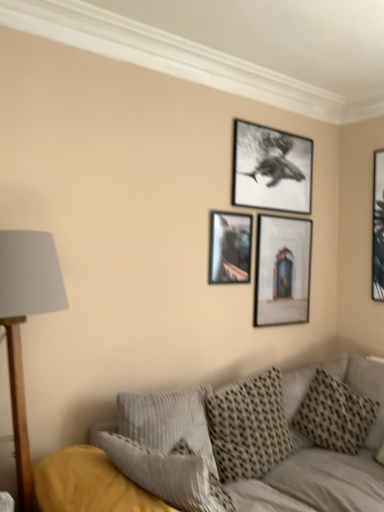
This screenshot has width=384, height=512. Find the location of `textured gray pillow at lower center, arranged as the 1th pillow when viewed from the left`. textured gray pillow at lower center, arranged as the 1th pillow when viewed from the left is located at coordinates (168, 420).

Describe the element at coordinates (271, 169) in the screenshot. I see `black matte picture frame at upper center, positioned as the second picture frame in left-to-right order` at that location.

This screenshot has width=384, height=512. What do you see at coordinates (282, 270) in the screenshot?
I see `matte wooden picture frame at center, which ranks as the 2th picture frame in right-to-left order` at bounding box center [282, 270].

Image resolution: width=384 pixels, height=512 pixels. Describe the element at coordinates (334, 415) in the screenshot. I see `patterned fabric pillow at right, the 1th pillow positioned from the right` at that location.

Measure the distance between patterned fabric pillow at center, arranged as the second pillow when viewed from the left, and camera.

7.09 feet.

Measure the distance between point (x=220, y=458) and camera.

The distance of point (x=220, y=458) from camera is 2.20 meters.

The height and width of the screenshot is (512, 384). What do you see at coordinates (378, 227) in the screenshot? I see `matte black picture frame at right, arranged as the 4th picture frame when viewed from the left` at bounding box center [378, 227].

The width and height of the screenshot is (384, 512). What do you see at coordinates (234, 447) in the screenshot? I see `textured gray couch at lower right` at bounding box center [234, 447].

The height and width of the screenshot is (512, 384). I want to click on textured gray pillow at lower center, which is counted as the third pillow, starting from the right, so click(x=168, y=420).

Relative to wooden base with gray fabric lampshade at left, is metallic silver picture frame at center, placed as the first picture frame when sorted from left to right, in front or behind?

Visually, metallic silver picture frame at center, placed as the first picture frame when sorted from left to right, is located behind wooden base with gray fabric lampshade at left.

Measure the distance from metallic silver picture frame at center, which ranks as the 4th picture frame in right-to-left order, to wooden base with gray fabric lampshade at left.

They are 1.20 meters apart.

Does metallic silver picture frame at center, placed as the first picture frame when sorted from left to right, have a larger size compared to wooden base with gray fabric lampshade at left?

No.

Between metallic silver picture frame at center, placed as the first picture frame when sorted from left to right, and wooden base with gray fabric lampshade at left, which one has more height?

With more height is wooden base with gray fabric lampshade at left.

Considering the sizes of patterned fabric pillow at center, acting as the second pillow starting from the right, and patterned fabric pillow at right, the third pillow when ordered from left to right, in the image, is patterned fabric pillow at center, acting as the second pillow starting from the right, wider or thinner than patterned fabric pillow at right, the third pillow when ordered from left to right,?

Considering their sizes, patterned fabric pillow at center, acting as the second pillow starting from the right, looks slimmer than patterned fabric pillow at right, the third pillow when ordered from left to right.

Identify the location of pillow below the patterned fabric pillow at right, the third pillow when ordered from left to right (from the image's perspective). (249, 426).

Considering the positions of objects patterned fabric pillow at center, acting as the second pillow starting from the right, and patterned fabric pillow at right, the third pillow when ordered from left to right, in the image provided, who is more to the right, patterned fabric pillow at center, acting as the second pillow starting from the right, or patterned fabric pillow at right, the third pillow when ordered from left to right,?

patterned fabric pillow at right, the third pillow when ordered from left to right.

Would you say patterned fabric pillow at center, acting as the second pillow starting from the right, is inside or outside patterned fabric pillow at right, the third pillow when ordered from left to right?

patterned fabric pillow at center, acting as the second pillow starting from the right, lies outside patterned fabric pillow at right, the third pillow when ordered from left to right.

Is black matte picture frame at upper center, positioned as the second picture frame in left-to-right order, located outside textured gray couch at lower right?

Yes, black matte picture frame at upper center, positioned as the second picture frame in left-to-right order, is located beyond the bounds of textured gray couch at lower right.

From the image's perspective, does black matte picture frame at upper center, the 3th picture frame in the right-to-left sequence, appear lower than textured gray couch at lower right?

No, from the image's perspective, black matte picture frame at upper center, the 3th picture frame in the right-to-left sequence, is not below textured gray couch at lower right.

Measure the distance from black matte picture frame at upper center, the 3th picture frame in the right-to-left sequence, to textured gray couch at lower right.

black matte picture frame at upper center, the 3th picture frame in the right-to-left sequence, is 4.37 feet away from textured gray couch at lower right.

How many degrees apart are the facing directions of black matte picture frame at upper center, the 3th picture frame in the right-to-left sequence, and textured gray couch at lower right?

92 degrees separate the facing orientations of black matte picture frame at upper center, the 3th picture frame in the right-to-left sequence, and textured gray couch at lower right.

Is black matte picture frame at upper center, the 3th picture frame in the right-to-left sequence, facing away from patterned fabric pillow at right, the third pillow when ordered from left to right?

No.

Based on the photo, is black matte picture frame at upper center, positioned as the second picture frame in left-to-right order, inside the boundaries of patterned fabric pillow at right, the third pillow when ordered from left to right, or outside?

black matte picture frame at upper center, positioned as the second picture frame in left-to-right order, is located beyond the bounds of patterned fabric pillow at right, the third pillow when ordered from left to right.

Between black matte picture frame at upper center, the 3th picture frame in the right-to-left sequence, and patterned fabric pillow at right, the 1th pillow positioned from the right, which one has smaller width?

black matte picture frame at upper center, the 3th picture frame in the right-to-left sequence.

Between point (272, 131) and point (305, 401), which one is positioned in front?

The point (305, 401) is in front.

From the image's perspective, is matte wooden picture frame at center, which ranks as the 2th picture frame in right-to-left order, above metallic silver picture frame at center, placed as the first picture frame when sorted from left to right?

No, from the image's perspective, matte wooden picture frame at center, which ranks as the 2th picture frame in right-to-left order, is not on top of metallic silver picture frame at center, placed as the first picture frame when sorted from left to right.

Considering the sizes of matte wooden picture frame at center, which ranks as the 2th picture frame in right-to-left order, and metallic silver picture frame at center, which ranks as the 4th picture frame in right-to-left order, in the image, is matte wooden picture frame at center, which ranks as the 2th picture frame in right-to-left order, bigger or smaller than metallic silver picture frame at center, which ranks as the 4th picture frame in right-to-left order,?

In the image, matte wooden picture frame at center, which ranks as the 2th picture frame in right-to-left order, appears to be larger than metallic silver picture frame at center, which ranks as the 4th picture frame in right-to-left order.

Could you tell me if matte wooden picture frame at center, the third picture frame when ordered from left to right, is facing metallic silver picture frame at center, placed as the first picture frame when sorted from left to right?

No, matte wooden picture frame at center, the third picture frame when ordered from left to right, is not oriented towards metallic silver picture frame at center, placed as the first picture frame when sorted from left to right.

From the picture: Which object is further away from the camera taking this photo, matte wooden picture frame at center, the third picture frame when ordered from left to right, or metallic silver picture frame at center, which ranks as the 4th picture frame in right-to-left order?

matte wooden picture frame at center, the third picture frame when ordered from left to right, is further from the camera.

Considering the relative sizes of matte wooden picture frame at center, the third picture frame when ordered from left to right, and textured gray pillow at lower center, arranged as the 1th pillow when viewed from the left, in the image provided, is matte wooden picture frame at center, the third picture frame when ordered from left to right, bigger than textured gray pillow at lower center, arranged as the 1th pillow when viewed from the left,?

Incorrect, matte wooden picture frame at center, the third picture frame when ordered from left to right, is not larger than textured gray pillow at lower center, arranged as the 1th pillow when viewed from the left.

How far apart are matte wooden picture frame at center, the third picture frame when ordered from left to right, and textured gray pillow at lower center, arranged as the 1th pillow when viewed from the left?

matte wooden picture frame at center, the third picture frame when ordered from left to right, and textured gray pillow at lower center, arranged as the 1th pillow when viewed from the left, are 37.19 inches apart from each other.

Which is less distant, (276, 233) or (186, 438)?

Point (276, 233) appears to be farther away from the viewer than point (186, 438).

There is a matte wooden picture frame at center, the third picture frame when ordered from left to right. Find the location of `the 1st pillow below it (from a real-world perspective)`. the 1st pillow below it (from a real-world perspective) is located at coordinates (168, 420).

Does patterned fabric pillow at center, arranged as the second pillow when viewed from the left, appear on the right side of textured gray couch at lower right?

In fact, patterned fabric pillow at center, arranged as the second pillow when viewed from the left, is to the left of textured gray couch at lower right.

Which is less distant, (265, 471) or (160, 453)?

Point (265, 471).

Who is smaller, patterned fabric pillow at center, arranged as the second pillow when viewed from the left, or textured gray couch at lower right?

patterned fabric pillow at center, arranged as the second pillow when viewed from the left.

Locate an element on the screen. The width and height of the screenshot is (384, 512). picture frame that is the 2nd one above the wooden base with gray fabric lampshade at left (from a real-world perspective) is located at coordinates (230, 247).

The image size is (384, 512). I want to click on pillow that appears below the patterned fabric pillow at right, the third pillow when ordered from left to right (from the image's perspective), so point(249,426).

Estimate the real-world distances between objects in this image. Which object is closer to matte wooden picture frame at center, the third picture frame when ordered from left to right, wooden base with gray fabric lampshade at left or textured gray couch at lower right?

Based on the image, textured gray couch at lower right appears to be nearer to matte wooden picture frame at center, the third picture frame when ordered from left to right.

Considering their positions, is matte black picture frame at right, the first picture frame positioned from the right, positioned further to patterned fabric pillow at center, acting as the second pillow starting from the right, than textured gray couch at lower right?

matte black picture frame at right, the first picture frame positioned from the right, lies further to patterned fabric pillow at center, acting as the second pillow starting from the right, than the other object.

When comparing their distances from matte wooden picture frame at center, which ranks as the 2th picture frame in right-to-left order, does textured gray couch at lower right or patterned fabric pillow at center, arranged as the second pillow when viewed from the left, seem closer?

Based on the image, patterned fabric pillow at center, arranged as the second pillow when viewed from the left, appears to be nearer to matte wooden picture frame at center, which ranks as the 2th picture frame in right-to-left order.

When comparing their distances from matte wooden picture frame at center, the third picture frame when ordered from left to right, does matte black picture frame at right, arranged as the 4th picture frame when viewed from the left, or patterned fabric pillow at right, the third pillow when ordered from left to right, seem further?

Among the two, patterned fabric pillow at right, the third pillow when ordered from left to right, is located further to matte wooden picture frame at center, the third picture frame when ordered from left to right.

Based on their spatial positions, is black matte picture frame at upper center, the 3th picture frame in the right-to-left sequence, or textured gray couch at lower right closer to metallic silver picture frame at center, placed as the first picture frame when sorted from left to right?

black matte picture frame at upper center, the 3th picture frame in the right-to-left sequence, lies closer to metallic silver picture frame at center, placed as the first picture frame when sorted from left to right, than the other object.

Looking at the image, which one is located closer to patterned fabric pillow at center, acting as the second pillow starting from the right, matte wooden picture frame at center, the third picture frame when ordered from left to right, or metallic silver picture frame at center, which ranks as the 4th picture frame in right-to-left order?

matte wooden picture frame at center, the third picture frame when ordered from left to right, is closer to patterned fabric pillow at center, acting as the second pillow starting from the right.

When comparing their distances from textured gray pillow at lower center, which is counted as the third pillow, starting from the right, does matte black picture frame at right, the first picture frame positioned from the right, or textured gray couch at lower right seem closer?

textured gray couch at lower right is positioned closer to the anchor textured gray pillow at lower center, which is counted as the third pillow, starting from the right.

Based on their spatial positions, is patterned fabric pillow at center, arranged as the second pillow when viewed from the left, or matte wooden picture frame at center, which ranks as the 2th picture frame in right-to-left order, further from textured gray couch at lower right?

The object further to textured gray couch at lower right is matte wooden picture frame at center, which ranks as the 2th picture frame in right-to-left order.

Image resolution: width=384 pixels, height=512 pixels. Find the location of `pillow between textured gray pillow at lower center, arranged as the 1th pillow when viewed from the left, and patterned fabric pillow at right, the 1th pillow positioned from the right, from left to right`. pillow between textured gray pillow at lower center, arranged as the 1th pillow when viewed from the left, and patterned fabric pillow at right, the 1th pillow positioned from the right, from left to right is located at coordinates (249, 426).

What are the coordinates of `picture frame between black matte picture frame at upper center, positioned as the second picture frame in left-to-right order, and matte black picture frame at right, the first picture frame positioned from the right, from left to right` in the screenshot? It's located at pos(282,270).

The height and width of the screenshot is (512, 384). What are the coordinates of `picture frame located between wooden base with gray fabric lampshade at left and patterned fabric pillow at center, acting as the second pillow starting from the right, in the left-right direction` in the screenshot? It's located at (230, 247).

This screenshot has height=512, width=384. Find the location of `picture frame between metallic silver picture frame at center, placed as the first picture frame when sorted from left to right, and patterned fabric pillow at center, acting as the second pillow starting from the right, in the up-down direction`. picture frame between metallic silver picture frame at center, placed as the first picture frame when sorted from left to right, and patterned fabric pillow at center, acting as the second pillow starting from the right, in the up-down direction is located at coordinates (282, 270).